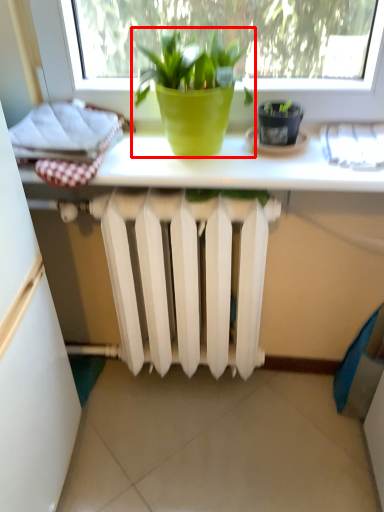
Question: Observing the image, what is the correct spatial positioning of houseplant (annotated by the red box) in reference to flowerpot?

Choices:
 (A) left
 (B) right

Answer: (A)